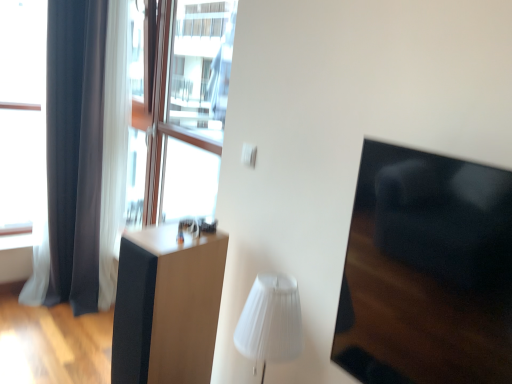
You are a GUI agent. You are given a task and a screenshot of the screen. Output one action in this format:
    pyautogui.click(x=<x>, y=<y>)
    Task: Click on the transparent glass window at upper left
    
    Given the screenshot: What is the action you would take?
    pyautogui.click(x=180, y=110)

Identify the location of black glossy armchair at right. Image resolution: width=512 pixels, height=384 pixels. (426, 271).

This screenshot has height=384, width=512. What do you see at coordinates (75, 156) in the screenshot?
I see `dark gray fabric curtain at left` at bounding box center [75, 156].

What is the approximate width of white pleated shade at center?

white pleated shade at center is 7.72 inches wide.

Image resolution: width=512 pixels, height=384 pixels. What are the coordinates of `matte black speaker at center` in the screenshot? It's located at (167, 307).

In the image, is transparent glass window at upper left positioned in front of or behind matte black speaker at center?

In the image, transparent glass window at upper left appears behind matte black speaker at center.

Is transparent glass window at upper left facing away from matte black speaker at center?

No, transparent glass window at upper left is not facing away from matte black speaker at center.

Identify the location of furniture below the transparent glass window at upper left (from the image's perspective). The image size is (512, 384). (167, 307).

Is white pleated shade at center not close to matte black speaker at center?

No, white pleated shade at center is in close proximity to matte black speaker at center.

In the scene shown: Is white pleated shade at center at the right side of matte black speaker at center?

Yes.

From the image's perspective, between white pleated shade at center and matte black speaker at center, which one is located above?

From the image's view, white pleated shade at center is above.

Considering the positions of point (243, 325) and point (159, 302), is point (243, 325) closer or farther from the camera than point (159, 302)?

Clearly, point (243, 325) is closer to the camera than point (159, 302).

From the image's perspective, is dark gray fabric curtain at left on top of transparent glass window at upper left?

Actually, dark gray fabric curtain at left appears below transparent glass window at upper left in the image.

How many degrees apart are the facing directions of dark gray fabric curtain at left and transparent glass window at upper left?

dark gray fabric curtain at left and transparent glass window at upper left are facing 91 degrees away from each other.

Would you say dark gray fabric curtain at left is to the left or to the right of transparent glass window at upper left in the picture?

Based on their positions, dark gray fabric curtain at left is located to the left of transparent glass window at upper left.

What's the angular difference between black glossy armchair at right and matte black speaker at center's facing directions?

The angular difference between black glossy armchair at right and matte black speaker at center is 11.7 degrees.

Is black glossy armchair at right facing towards matte black speaker at center?

No, black glossy armchair at right is not turned towards matte black speaker at center.

From the image's perspective, is black glossy armchair at right above matte black speaker at center?

Correct, black glossy armchair at right appears higher than matte black speaker at center in the image.

Where is `armchair to the right of matte black speaker at center`? This screenshot has height=384, width=512. armchair to the right of matte black speaker at center is located at coordinates (426, 271).

Which object is closer to the camera, black glossy armchair at right or transparent glass window at upper left?

black glossy armchair at right is more forward.

Considering the sizes of objects black glossy armchair at right and transparent glass window at upper left in the image provided, who is wider, black glossy armchair at right or transparent glass window at upper left?

transparent glass window at upper left.

Is black glossy armchair at right located outside transparent glass window at upper left?

Yes, black glossy armchair at right is located beyond the bounds of transparent glass window at upper left.

From the picture: How much distance is there between black glossy armchair at right and transparent glass window at upper left?

The distance of black glossy armchair at right from transparent glass window at upper left is 5.37 feet.

From a real-world perspective, is white pleated shade at center positioned above or below transparent glass window at upper left?

white pleated shade at center is below transparent glass window at upper left.

Can you see white pleated shade at center touching transparent glass window at upper left?

No, white pleated shade at center is not touching transparent glass window at upper left.

Considering the positions of objects white pleated shade at center and transparent glass window at upper left in the image provided, who is more to the left, white pleated shade at center or transparent glass window at upper left?

From the viewer's perspective, transparent glass window at upper left appears more on the left side.

How much distance is there between white pleated shade at center and transparent glass window at upper left?

4.73 feet.

Could you tell me if black glossy armchair at right is turned towards white pleated shade at center?

No, black glossy armchair at right does not turn towards white pleated shade at center.

Can you tell me how much black glossy armchair at right and white pleated shade at center differ in facing direction?

The facing directions of black glossy armchair at right and white pleated shade at center are 2.68 degrees apart.

Which is more to the left, black glossy armchair at right or white pleated shade at center?

From the viewer's perspective, white pleated shade at center appears more on the left side.

From the picture: Would you say black glossy armchair at right is a long distance from white pleated shade at center?

Actually, black glossy armchair at right and white pleated shade at center are a little close together.

The width and height of the screenshot is (512, 384). Find the location of `furniture below the transparent glass window at upper left (from a real-world perspective)`. furniture below the transparent glass window at upper left (from a real-world perspective) is located at coordinates (167, 307).

Identify the location of table lamp that appears on the right of matte black speaker at center. (270, 321).

Looking at the image, which one is located closer to matte black speaker at center, black glossy armchair at right or transparent glass window at upper left?

The object closer to matte black speaker at center is black glossy armchair at right.

From the image, which object appears to be nearer to transparent glass window at upper left, dark gray fabric curtain at left or white pleated shade at center?

Among the two, dark gray fabric curtain at left is located nearer to transparent glass window at upper left.

Which object lies nearer to the anchor point white pleated shade at center, dark gray fabric curtain at left or transparent glass window at upper left?

transparent glass window at upper left is positioned closer to the anchor white pleated shade at center.

Consider the image. Considering their positions, is black glossy armchair at right positioned closer to dark gray fabric curtain at left than matte black speaker at center?

matte black speaker at center.

Based on their spatial positions, is white pleated shade at center or dark gray fabric curtain at left further from black glossy armchair at right?

Based on the image, dark gray fabric curtain at left appears to be further to black glossy armchair at right.

Consider the image. When comparing their distances from dark gray fabric curtain at left, does transparent glass window at upper left or white pleated shade at center seem further?

Among the two, white pleated shade at center is located further to dark gray fabric curtain at left.

Considering their positions, is white pleated shade at center positioned closer to dark gray fabric curtain at left than transparent glass window at upper left?

The object closer to dark gray fabric curtain at left is transparent glass window at upper left.

Based on the photo, estimate the real-world distances between objects in this image. Which object is closer to black glossy armchair at right, matte black speaker at center or dark gray fabric curtain at left?

matte black speaker at center is closer to black glossy armchair at right.

Locate an element on the screen. Image resolution: width=512 pixels, height=384 pixels. furniture between black glossy armchair at right and transparent glass window at upper left from front to back is located at coordinates point(167,307).

Find the location of a particular element. curtain between transparent glass window at upper left and matte black speaker at center in the up-down direction is located at coordinates (75, 156).

This screenshot has width=512, height=384. In order to click on furniture between dark gray fabric curtain at left and white pleated shade at center from left to right in this screenshot , I will do `click(167, 307)`.

The width and height of the screenshot is (512, 384). What are the coordinates of `table lamp positioned between black glossy armchair at right and transparent glass window at upper left from near to far` in the screenshot? It's located at (270, 321).